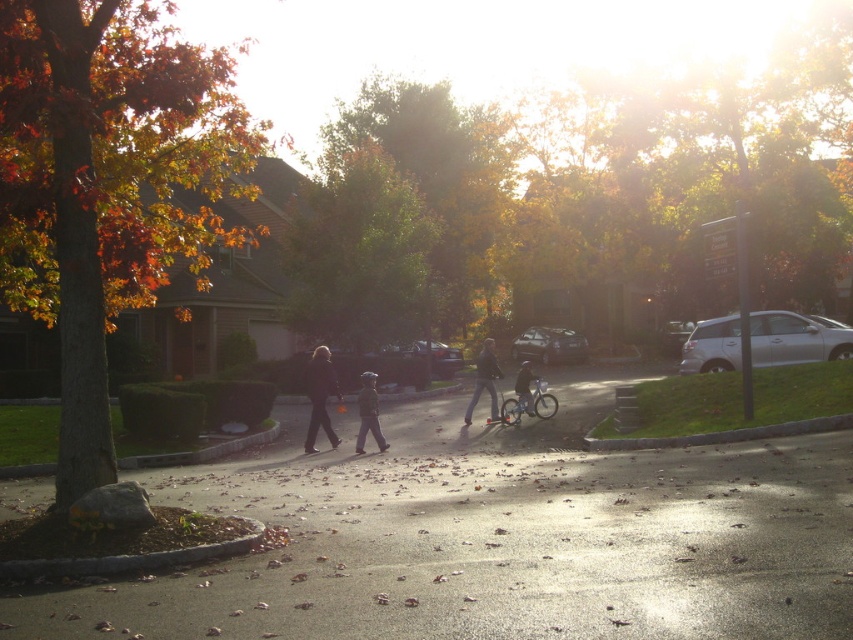
Based on the photo, you are a pedestrian standing at the autumn leaves at left and want to reach the dark matte jacket at center. Is the distance between them sufficient for you to walk directly to the jacket without needing to detour around any obstacles?

The distance between autumn leaves at left and dark matte jacket at center is 9.86 meters, so yes, you can walk directly to the jacket without needing to detour around any obstacles as there are no mentioned obstacles in the scene description.

You are standing on the sidewalk in the suburban scene. You see autumn leaves at left and a dark matte jacket at center. Which object is closer to you?

The autumn leaves at left are closer to the viewer than the dark matte jacket at center.

You are a delivery robot that is 1.2 meters wide. You need to cross the road while avoiding the tree. Can you fit through the space between the smooth asphalt road at center and the green leafy tree at center?

The smooth asphalt road at center is wider than the green leafy tree at center, so the delivery robot can fit through the space between them since the road is wider than the tree.